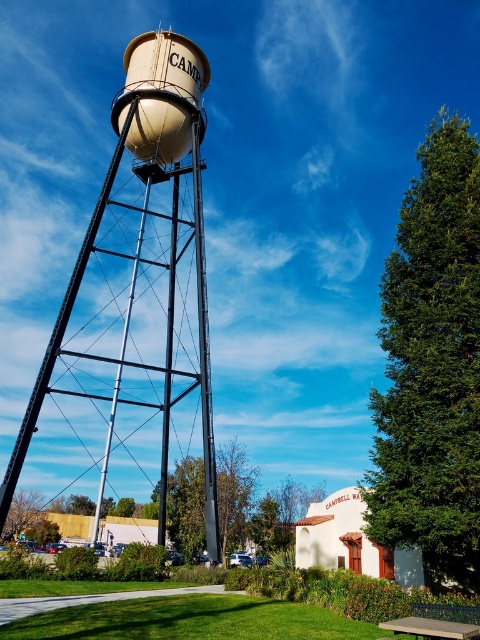
You are a visitor at a park and want to take a photo of the matte beige water tower at center and the concrete bench at lower right. Where should you stand to ensure both are in the frame?

You should stand to the right of the concrete bench at lower right so that the matte beige water tower at center, which is on the left side of the concrete bench at lower right, can be captured in the photo.

You are a maintenance worker who needs to inspect the beige matte water tower at upper center from the concrete bench at lower right. Given that the distance between them is 71.78 feet, can you walk directly from the bench to the base of the water tower without any obstacles?

The beige matte water tower at upper center is 71.78 feet from the concrete bench at lower right, so yes, you can walk directly from the bench to the base of the water tower since there are no obstacles mentioned in the scene description.

You are a landscape designer planning to install a new garden feature between the matte beige water tower at center and the beige matte water tower at upper center. Which water tower should you place the garden closer to if you want it near the central area of the image?

The matte beige water tower at center is positioned on the left side of the beige matte water tower at upper center, so placing the garden closer to the matte beige water tower at center would position it nearer to the central area of the image.